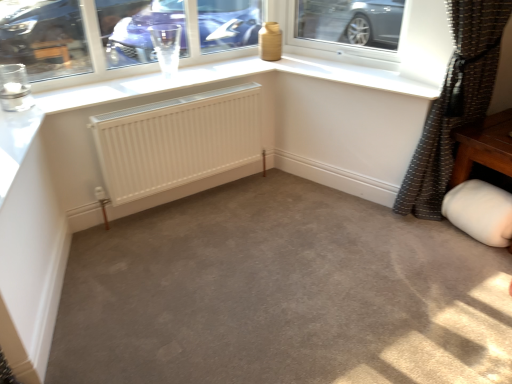
At what (x,y) coordinates should I click in order to perform the action: click on vacant area that lies between white matte radiator at center and white matte jar at lower right. Please return your answer as a coordinate pair (x, y). This screenshot has height=384, width=512. Looking at the image, I should click on (280, 218).